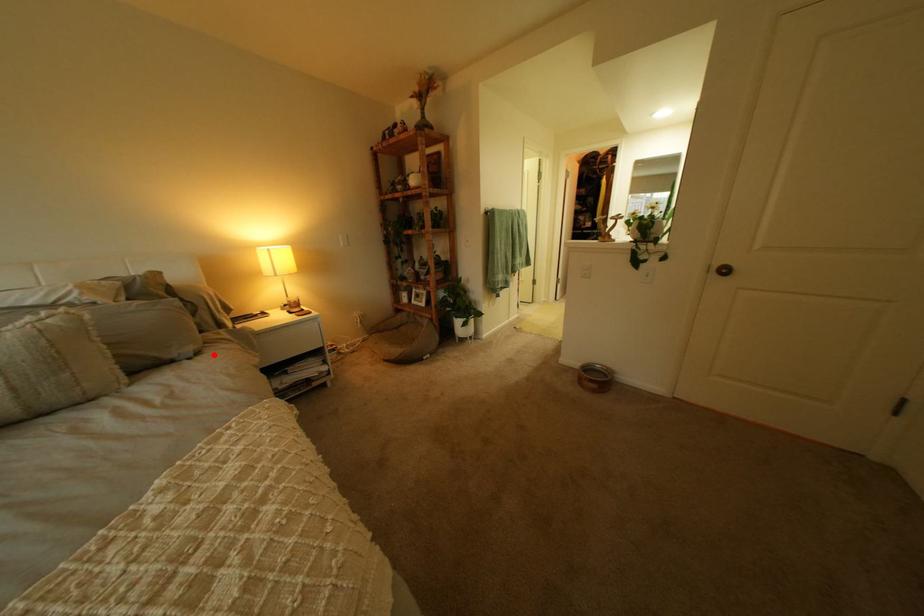
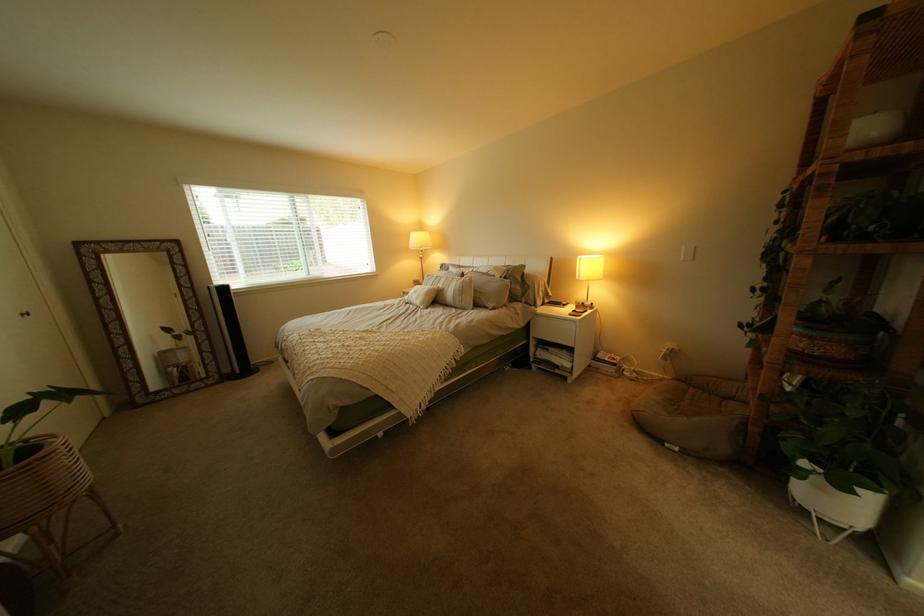
In the second image, find the point that corresponds to the highlighted location in the first image.

(509, 310)